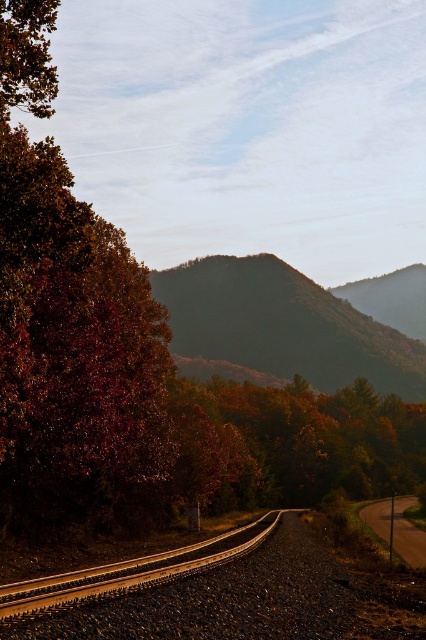
Is green matte hillside at center further to camera compared to autumn leaves at center?

Yes, it is.

Locate an element on the screen. Image resolution: width=426 pixels, height=640 pixels. green matte hillside at center is located at coordinates (282, 324).

Which is more to the right, green matte hillside at center or brown gravel track at center?

Positioned to the right is green matte hillside at center.

Between green matte hillside at center and brown gravel track at center, which one has more height?

green matte hillside at center is taller.

You are a GUI agent. You are given a task and a screenshot of the screen. Output one action in this format:
    pyautogui.click(x=<x>, y=<y>)
    Task: Click on the green matte hillside at center
    
    Given the screenshot: What is the action you would take?
    pyautogui.click(x=282, y=324)

Where is `green matte hillside at center`? The width and height of the screenshot is (426, 640). green matte hillside at center is located at coordinates (x=282, y=324).

Can you confirm if autumn leaves at center is positioned to the left of brown gravel track at center?

Incorrect, autumn leaves at center is not on the left side of brown gravel track at center.

Who is more distant from viewer, (236,413) or (100,588)?

The point (236,413) is behind.

The height and width of the screenshot is (640, 426). What are the coordinates of `autumn leaves at center` in the screenshot? It's located at [313, 440].